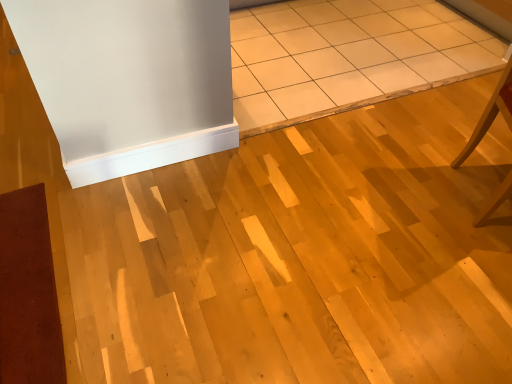
Find the location of a particular element. The image size is (512, 384). vacant space positioned to the left of wooden chair leg at right is located at coordinates (405, 194).